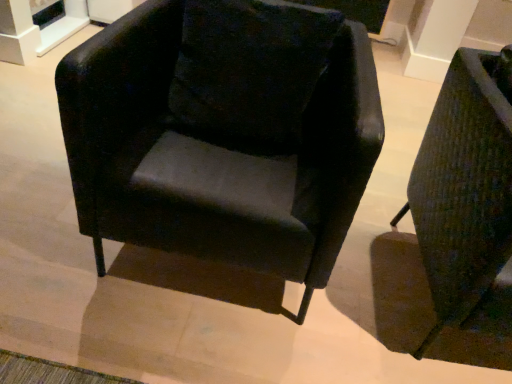
Question: Which direction should I rotate to look at matte black armchair at center, arranged as the 1th chair when viewed from the left?

Choices:
 (A) left
 (B) right

Answer: (A)

Question: Considering the relative sizes of textured green fabric armchair at right, which is counted as the first chair, starting from the right, and velvet black pillow at center in the image provided, is textured green fabric armchair at right, which is counted as the first chair, starting from the right, taller than velvet black pillow at center?

Choices:
 (A) no
 (B) yes

Answer: (B)

Question: From the image's perspective, does textured green fabric armchair at right, the 2th chair positioned from the left, appear higher than velvet black pillow at center?

Choices:
 (A) yes
 (B) no

Answer: (B)

Question: From the image's perspective, is textured green fabric armchair at right, which is counted as the first chair, starting from the right, beneath velvet black pillow at center?

Choices:
 (A) no
 (B) yes

Answer: (B)

Question: Can you confirm if textured green fabric armchair at right, which is counted as the first chair, starting from the right, is wider than velvet black pillow at center?

Choices:
 (A) no
 (B) yes

Answer: (B)

Question: From a real-world perspective, is textured green fabric armchair at right, which is counted as the first chair, starting from the right, positioned over velvet black pillow at center based on gravity?

Choices:
 (A) yes
 (B) no

Answer: (B)

Question: Does textured green fabric armchair at right, which is counted as the first chair, starting from the right, have a lesser width compared to velvet black pillow at center?

Choices:
 (A) yes
 (B) no

Answer: (B)

Question: Does textured green fabric armchair at right, which is counted as the first chair, starting from the right, have a greater height compared to matte black armchair at center, arranged as the 1th chair when viewed from the left?

Choices:
 (A) yes
 (B) no

Answer: (A)

Question: From a real-world perspective, is textured green fabric armchair at right, which is counted as the first chair, starting from the right, located beneath matte black armchair at center, arranged as the 1th chair when viewed from the left?

Choices:
 (A) yes
 (B) no

Answer: (A)

Question: Is textured green fabric armchair at right, the 2th chair positioned from the left, not within matte black armchair at center, positioned as the 2th chair in right-to-left order?

Choices:
 (A) no
 (B) yes

Answer: (B)

Question: Are textured green fabric armchair at right, the 2th chair positioned from the left, and matte black armchair at center, positioned as the 2th chair in right-to-left order, located far from each other?

Choices:
 (A) yes
 (B) no

Answer: (B)

Question: Does textured green fabric armchair at right, the 2th chair positioned from the left, come behind matte black armchair at center, positioned as the 2th chair in right-to-left order?

Choices:
 (A) yes
 (B) no

Answer: (B)

Question: Is textured green fabric armchair at right, the 2th chair positioned from the left, aimed at matte black armchair at center, positioned as the 2th chair in right-to-left order?

Choices:
 (A) no
 (B) yes

Answer: (A)

Question: Considering the relative sizes of velvet black pillow at center and textured green fabric armchair at right, the 2th chair positioned from the left, in the image provided, is velvet black pillow at center thinner than textured green fabric armchair at right, the 2th chair positioned from the left,?

Choices:
 (A) no
 (B) yes

Answer: (B)